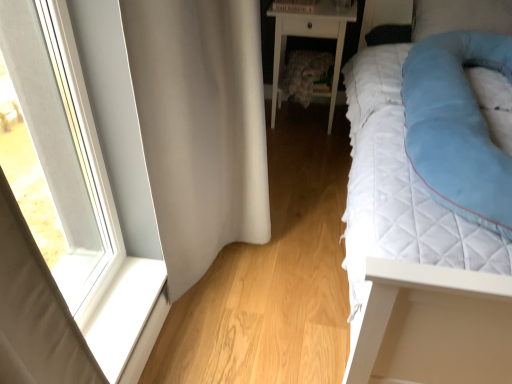
Question: Does clear glass window at left have a smaller size compared to light blue quilted pillow at right?

Choices:
 (A) yes
 (B) no

Answer: (A)

Question: Is clear glass window at left completely or partially outside of light blue quilted pillow at right?

Choices:
 (A) yes
 (B) no

Answer: (A)

Question: Is clear glass window at left wider than light blue quilted pillow at right?

Choices:
 (A) no
 (B) yes

Answer: (A)

Question: Is clear glass window at left shorter than light blue quilted pillow at right?

Choices:
 (A) no
 (B) yes

Answer: (A)

Question: Is clear glass window at left bigger than light blue quilted pillow at right?

Choices:
 (A) no
 (B) yes

Answer: (A)

Question: From a real-world perspective, is white glossy nightstand at center above or below white fabric curtain at left?

Choices:
 (A) below
 (B) above

Answer: (A)

Question: Is white glossy nightstand at center taller or shorter than white fabric curtain at left?

Choices:
 (A) short
 (B) tall

Answer: (A)

Question: Considering the positions of white glossy nightstand at center and white fabric curtain at left in the image, is white glossy nightstand at center bigger or smaller than white fabric curtain at left?

Choices:
 (A) small
 (B) big

Answer: (A)

Question: Looking at their shapes, would you say white glossy nightstand at center is wider or thinner than white fabric curtain at left?

Choices:
 (A) thin
 (B) wide

Answer: (B)

Question: Considering their positions, is white fabric curtain at left located in front of or behind white glossy nightstand at center?

Choices:
 (A) front
 (B) behind

Answer: (A)

Question: Is point (170, 6) closer or farther from the camera than point (334, 69)?

Choices:
 (A) closer
 (B) farther

Answer: (A)

Question: Is white fabric curtain at left wider or thinner than white glossy nightstand at center?

Choices:
 (A) thin
 (B) wide

Answer: (A)

Question: From a real-world perspective, is white fabric curtain at left physically located above or below white glossy nightstand at center?

Choices:
 (A) above
 (B) below

Answer: (A)

Question: From a real-world perspective, relative to white smooth window sill at lower left, is light blue quilted pillow at right vertically above or below?

Choices:
 (A) below
 (B) above

Answer: (B)

Question: Is light blue quilted pillow at right inside the boundaries of white smooth window sill at lower left, or outside?

Choices:
 (A) inside
 (B) outside

Answer: (B)